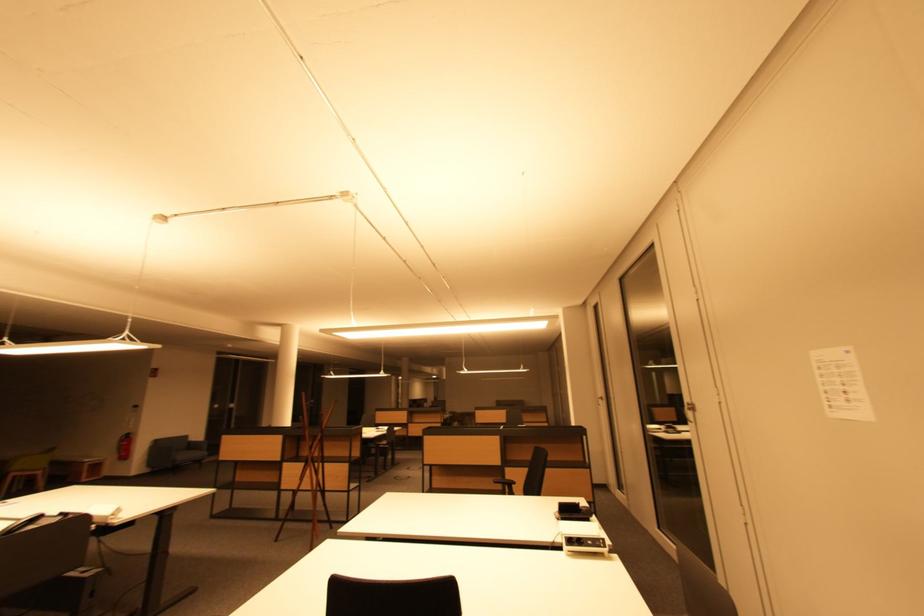
Where is `white phone buttons`? This screenshot has height=616, width=924. white phone buttons is located at coordinates (841, 384).